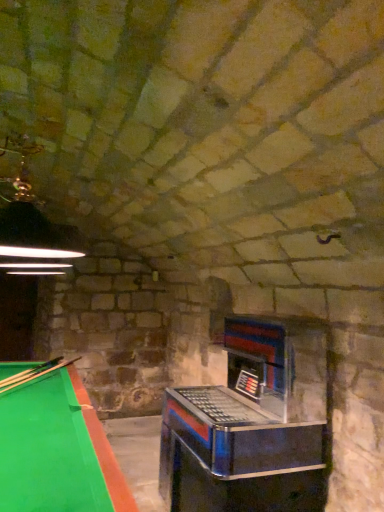
Question: From a real-world perspective, relative to metallic/reflective slot machine at center-right, is wooden smooth cue at lower left vertically above or below?

Choices:
 (A) below
 (B) above

Answer: (B)

Question: Based on their positions, is wooden smooth cue at lower left located to the left or right of metallic/reflective slot machine at center-right?

Choices:
 (A) right
 (B) left

Answer: (B)

Question: Does point (18, 379) appear closer or farther from the camera than point (162, 451)?

Choices:
 (A) closer
 (B) farther

Answer: (A)

Question: From the image's perspective, relative to wooden smooth cue at lower left, is metallic/reflective slot machine at center-right above or below?

Choices:
 (A) below
 (B) above

Answer: (A)

Question: Is metallic/reflective slot machine at center-right to the left or to the right of wooden smooth cue at lower left in the image?

Choices:
 (A) left
 (B) right

Answer: (B)

Question: From their relative heights in the image, would you say metallic/reflective slot machine at center-right is taller or shorter than wooden smooth cue at lower left?

Choices:
 (A) short
 (B) tall

Answer: (B)

Question: Is metallic/reflective slot machine at center-right situated inside wooden smooth cue at lower left or outside?

Choices:
 (A) outside
 (B) inside

Answer: (A)